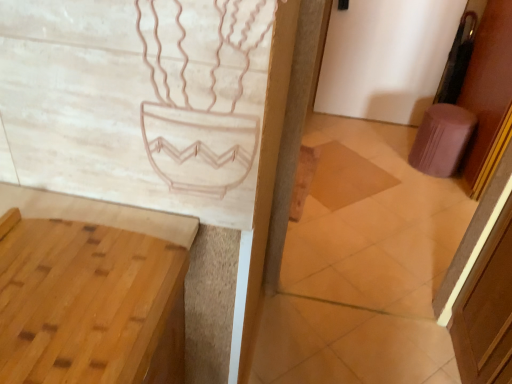
The image size is (512, 384). What do you see at coordinates (346, 176) in the screenshot?
I see `brown wooden tile at center` at bounding box center [346, 176].

Measure the distance between point (498, 24) and camera.

Point (498, 24) is 2.50 meters from camera.

The width and height of the screenshot is (512, 384). Identify the location of pink fabric stool at right. (441, 139).

The width and height of the screenshot is (512, 384). Identify the location of brown wooden tile at center. (346, 176).

Does light brown wood vanity at lower left appear on the right side of pink fabric stool at right?

No.

Considering the positions of objects light brown wood vanity at lower left and pink fabric stool at right in the image provided, who is in front, light brown wood vanity at lower left or pink fabric stool at right?

light brown wood vanity at lower left.

Which of these two, light brown wood vanity at lower left or pink fabric stool at right, is smaller?

Smaller between the two is pink fabric stool at right.

Is pink fabric stool at right taller than brown wooden tile at center?

Yes.

This screenshot has height=384, width=512. I want to click on tile below the pink fabric stool at right (from a real-world perspective), so click(x=346, y=176).

Which object is wider, pink fabric stool at right or brown wooden tile at center?

Wider between the two is brown wooden tile at center.

Does pink fabric stool at right touch brown wood screen door at right?

There is a gap between pink fabric stool at right and brown wood screen door at right.

Can you tell me how much pink fabric stool at right and brown wood screen door at right differ in facing direction?

There is a 91.2-degree angle between the facing directions of pink fabric stool at right and brown wood screen door at right.

Considering the relative sizes of pink fabric stool at right and brown wood screen door at right in the image provided, is pink fabric stool at right bigger than brown wood screen door at right?

Incorrect, pink fabric stool at right is not larger than brown wood screen door at right.

Is pink fabric stool at right to the right of brown wood screen door at right from the viewer's perspective?

Indeed, pink fabric stool at right is positioned on the right side of brown wood screen door at right.

Are light brown wood vanity at lower left and purple fabric door at right located far from each other?

Yes, light brown wood vanity at lower left and purple fabric door at right are quite far apart.

Is the position of light brown wood vanity at lower left more distant than that of purple fabric door at right?

No.

Between light brown wood vanity at lower left and purple fabric door at right, which one has larger width?

With larger width is light brown wood vanity at lower left.

Who is shorter, light brown wood vanity at lower left or purple fabric door at right?

light brown wood vanity at lower left.

Can you confirm if light brown wood vanity at lower left is thinner than brown wood screen door at right?

No, light brown wood vanity at lower left is not thinner than brown wood screen door at right.

Based on the photo, how far apart are light brown wood vanity at lower left and brown wood screen door at right?

light brown wood vanity at lower left and brown wood screen door at right are 1.15 meters apart from each other.

Considering the sizes of objects light brown wood vanity at lower left and brown wood screen door at right in the image provided, who is taller, light brown wood vanity at lower left or brown wood screen door at right?

brown wood screen door at right.

In terms of size, does light brown wood vanity at lower left appear bigger or smaller than brown wood screen door at right?

In the image, light brown wood vanity at lower left appears to be smaller than brown wood screen door at right.

In the image, there is a purple fabric door at right. At what (x,y) coordinates should I click in order to perform the action: click on stool below it (from a real-world perspective). Please return your answer as a coordinate pair (x, y). The image size is (512, 384). Looking at the image, I should click on (441, 139).

Considering the sizes of objects purple fabric door at right and pink fabric stool at right in the image provided, who is smaller, purple fabric door at right or pink fabric stool at right?

purple fabric door at right is smaller.

Can you confirm if purple fabric door at right is positioned to the right of pink fabric stool at right?

Correct, you'll find purple fabric door at right to the right of pink fabric stool at right.

Is purple fabric door at right oriented towards pink fabric stool at right?

Yes, purple fabric door at right is facing pink fabric stool at right.

Is brown wooden tile at center aimed at pink fabric stool at right?

No, brown wooden tile at center does not turn towards pink fabric stool at right.

Which is more to the right, brown wooden tile at center or pink fabric stool at right?

pink fabric stool at right.

Consider the image. Is brown wooden tile at center wider than pink fabric stool at right?

Yes, brown wooden tile at center is wider than pink fabric stool at right.

Based on their sizes in the image, would you say brown wooden tile at center is bigger or smaller than pink fabric stool at right?

Clearly, brown wooden tile at center is smaller in size than pink fabric stool at right.

This screenshot has width=512, height=384. In order to click on stool located on the right of light brown wood vanity at lower left in this screenshot , I will do `click(441, 139)`.

Identify the location of stool that is above the brown wooden tile at center (from a real-world perspective). Image resolution: width=512 pixels, height=384 pixels. (441, 139).

From the picture: Which object lies further to the anchor point light brown wood vanity at lower left, brown wood screen door at right or brown wooden tile at center?

The object further to light brown wood vanity at lower left is brown wooden tile at center.

Looking at the image, which one is located further to brown wood screen door at right, brown wooden tile at center or purple fabric door at right?

Among the two, purple fabric door at right is located further to brown wood screen door at right.

Considering their positions, is brown wood screen door at right positioned closer to brown wooden tile at center than light brown wood vanity at lower left?

brown wood screen door at right lies closer to brown wooden tile at center than the other object.

Estimate the real-world distances between objects in this image. Which object is further from brown wooden tile at center, light brown wood vanity at lower left or purple fabric door at right?

light brown wood vanity at lower left is positioned further to the anchor brown wooden tile at center.

Considering their positions, is brown wooden tile at center positioned further to pink fabric stool at right than light brown wood vanity at lower left?

The object further to pink fabric stool at right is light brown wood vanity at lower left.

Which object lies further to the anchor point purple fabric door at right, light brown wood vanity at lower left or pink fabric stool at right?

Based on the image, light brown wood vanity at lower left appears to be further to purple fabric door at right.

From the image, which object appears to be farther from pink fabric stool at right, purple fabric door at right or light brown wood vanity at lower left?

light brown wood vanity at lower left lies further to pink fabric stool at right than the other object.

Considering their positions, is brown wooden tile at center positioned further to pink fabric stool at right than purple fabric door at right?

brown wooden tile at center lies further to pink fabric stool at right than the other object.

The image size is (512, 384). Find the location of `screen door between light brown wood vanity at lower left and pink fabric stool at right from front to back`. screen door between light brown wood vanity at lower left and pink fabric stool at right from front to back is located at coordinates (486, 310).

Identify the location of stool between light brown wood vanity at lower left and purple fabric door at right from left to right. (441, 139).

In order to click on door between brown wood screen door at right and brown wooden tile at center along the z-axis in this screenshot , I will do pos(488,95).

The width and height of the screenshot is (512, 384). Find the location of `tile positioned between brown wood screen door at right and pink fabric stool at right from near to far`. tile positioned between brown wood screen door at right and pink fabric stool at right from near to far is located at coordinates (346, 176).